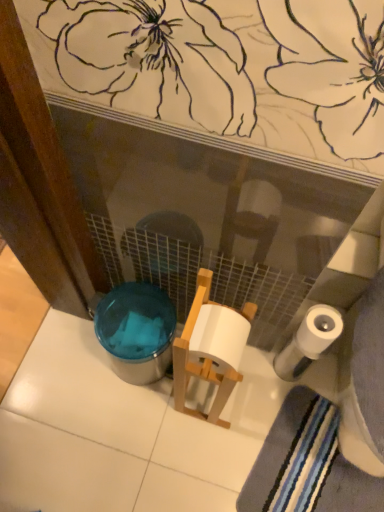
The image size is (384, 512). I want to click on blank space situated above striped cotton bath towel at lower right (from a real-world perspective), so click(x=318, y=465).